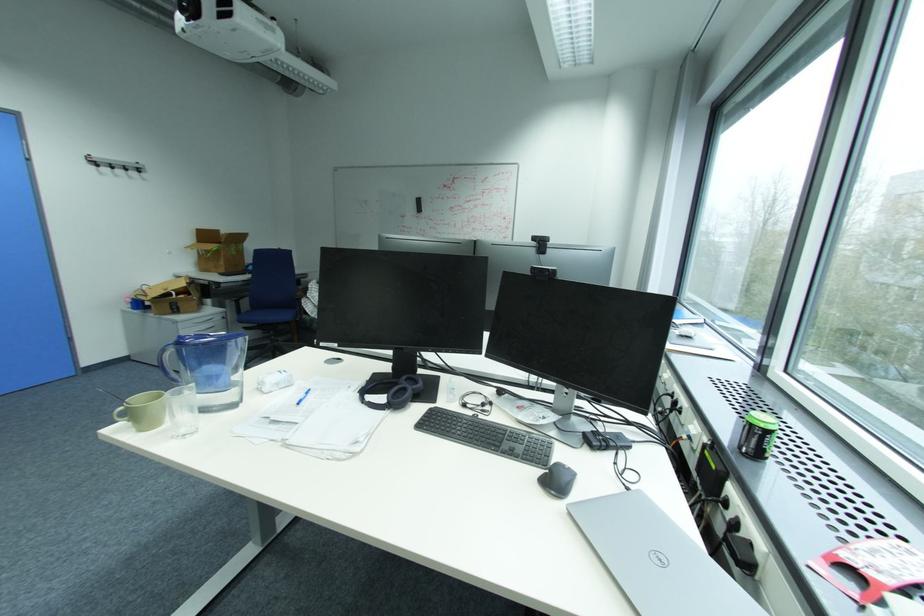
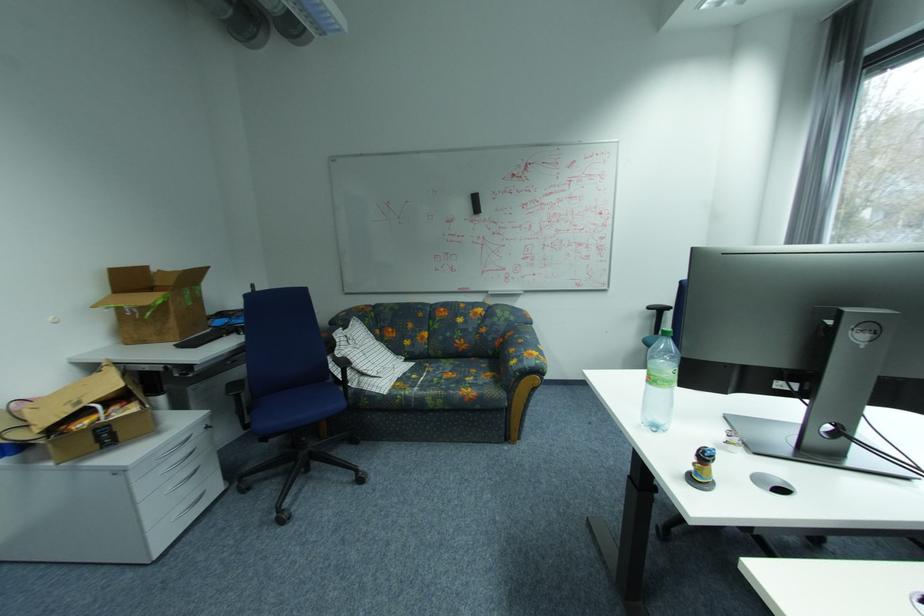
Find the pixel in the second image that matches the point at 246,302 in the first image.

(247, 395)